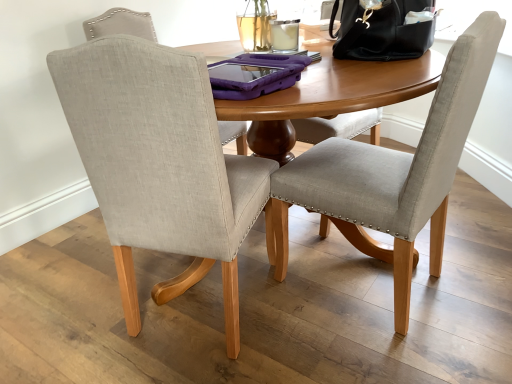
Question: From a real-world perspective, is light gray fabric chair at center, arranged as the 2th chair when viewed from the left, positioned under beige fabric chair at center, which appears as the 1th chair when viewed from the left, based on gravity?

Choices:
 (A) no
 (B) yes

Answer: (B)

Question: Is light gray fabric chair at center, arranged as the 2th chair when viewed from the left, aimed at beige fabric chair at center, which appears as the 1th chair when viewed from the left?

Choices:
 (A) yes
 (B) no

Answer: (B)

Question: From a real-world perspective, does light gray fabric chair at center, which ranks as the 1th chair in right-to-left order, stand above beige fabric chair at center, which appears as the 1th chair when viewed from the left?

Choices:
 (A) no
 (B) yes

Answer: (A)

Question: Is light gray fabric chair at center, arranged as the 2th chair when viewed from the left, thinner than beige fabric chair at center, the second chair in the right-to-left sequence?

Choices:
 (A) yes
 (B) no

Answer: (A)

Question: Can you confirm if light gray fabric chair at center, which ranks as the 1th chair in right-to-left order, is shorter than beige fabric chair at center, which appears as the 1th chair when viewed from the left?

Choices:
 (A) no
 (B) yes

Answer: (B)

Question: Is light gray fabric chair at center, arranged as the 2th chair when viewed from the left, facing away from beige fabric chair at center, the second chair in the right-to-left sequence?

Choices:
 (A) yes
 (B) no

Answer: (B)

Question: From the image's perspective, is black leather handbag at upper right over beige fabric chair at center, the second chair in the right-to-left sequence?

Choices:
 (A) no
 (B) yes

Answer: (B)

Question: Is black leather handbag at upper right positioned in front of beige fabric chair at center, the second chair in the right-to-left sequence?

Choices:
 (A) yes
 (B) no

Answer: (B)

Question: Is beige fabric chair at center, the second chair in the right-to-left sequence, at the back of black leather handbag at upper right?

Choices:
 (A) yes
 (B) no

Answer: (B)

Question: Does black leather handbag at upper right turn towards beige fabric chair at center, the second chair in the right-to-left sequence?

Choices:
 (A) no
 (B) yes

Answer: (A)

Question: Is black leather handbag at upper right thinner than beige fabric chair at center, which appears as the 1th chair when viewed from the left?

Choices:
 (A) no
 (B) yes

Answer: (B)

Question: Considering the relative positions of black leather handbag at upper right and beige fabric chair at center, which appears as the 1th chair when viewed from the left, in the image provided, is black leather handbag at upper right behind beige fabric chair at center, which appears as the 1th chair when viewed from the left,?

Choices:
 (A) yes
 (B) no

Answer: (A)

Question: Does beige fabric chair at center, the second chair in the right-to-left sequence, have a greater width compared to light gray fabric chair at center, arranged as the 2th chair when viewed from the left?

Choices:
 (A) no
 (B) yes

Answer: (B)